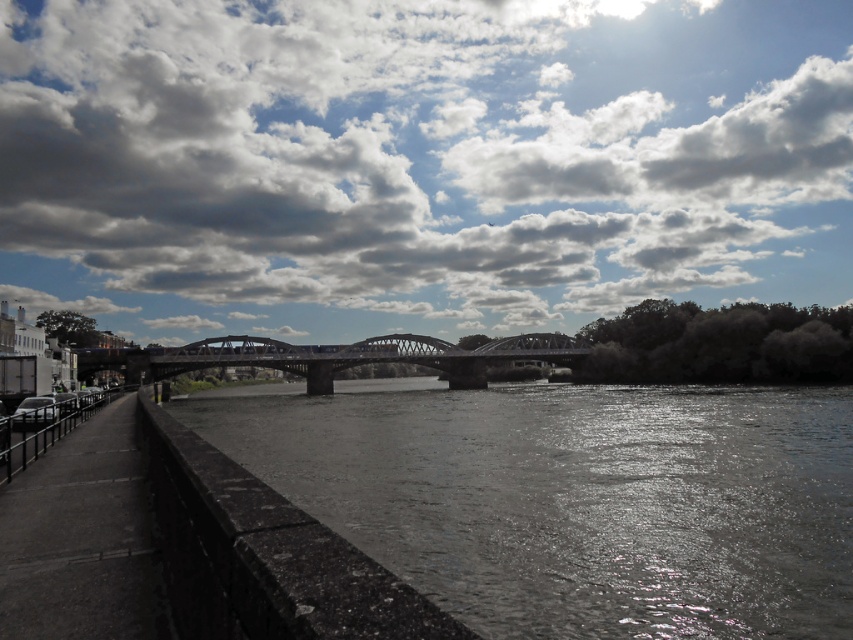
Question: Which point is farther from the camera taking this photo?

Choices:
 (A) (137, 243)
 (B) (474, 378)

Answer: (A)

Question: Can you confirm if cloudy sky at upper center is positioned above dark gray concrete river at center?

Choices:
 (A) yes
 (B) no

Answer: (A)

Question: Which of the following is the farthest from the observer?

Choices:
 (A) metallic bridge at center
 (B) dark gray concrete river at center
 (C) cloudy sky at upper center

Answer: (C)

Question: Which point is closer to the camera?

Choices:
 (A) (488, 349)
 (B) (16, 260)

Answer: (A)

Question: Is cloudy sky at upper center wider than dark gray concrete river at center?

Choices:
 (A) no
 (B) yes

Answer: (B)

Question: Does cloudy sky at upper center have a lesser width compared to metallic bridge at center?

Choices:
 (A) no
 (B) yes

Answer: (A)